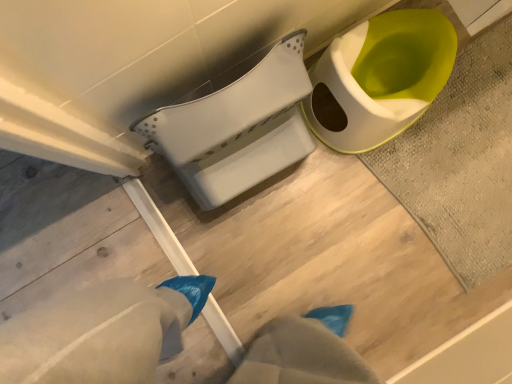
Question: Considering the relative positions of textured gray bath mat at upper right and matte white toilet at upper right, the second toilet in the left-to-right sequence, in the image provided, is textured gray bath mat at upper right behind matte white toilet at upper right, the second toilet in the left-to-right sequence,?

Choices:
 (A) no
 (B) yes

Answer: (B)

Question: Is textured gray bath mat at upper right oriented towards matte white toilet at upper right, the second toilet in the left-to-right sequence?

Choices:
 (A) no
 (B) yes

Answer: (A)

Question: Can you confirm if textured gray bath mat at upper right is shorter than matte white toilet at upper right, which is counted as the 1th toilet, starting from the right?

Choices:
 (A) yes
 (B) no

Answer: (A)

Question: From the image's perspective, would you say textured gray bath mat at upper right is shown under matte white toilet at upper right, which is counted as the 1th toilet, starting from the right?

Choices:
 (A) yes
 (B) no

Answer: (A)

Question: Can you confirm if textured gray bath mat at upper right is positioned to the right of matte white toilet at upper right, the second toilet in the left-to-right sequence?

Choices:
 (A) yes
 (B) no

Answer: (A)

Question: Is matte white toilet at upper right, which is counted as the 1th toilet, starting from the right, at the back of textured gray bath mat at upper right?

Choices:
 (A) no
 (B) yes

Answer: (A)

Question: Considering the relative positions of matte white toilet at upper right, the second toilet in the left-to-right sequence, and white plastic toilet at center, which ranks as the second toilet in right-to-left order, in the image provided, is matte white toilet at upper right, the second toilet in the left-to-right sequence, to the left of white plastic toilet at center, which ranks as the second toilet in right-to-left order, from the viewer's perspective?

Choices:
 (A) yes
 (B) no

Answer: (B)

Question: Is matte white toilet at upper right, the second toilet in the left-to-right sequence, touching white plastic toilet at center, arranged as the 1th toilet when viewed from the left?

Choices:
 (A) yes
 (B) no

Answer: (B)

Question: Does matte white toilet at upper right, the second toilet in the left-to-right sequence, contain white plastic toilet at center, which ranks as the second toilet in right-to-left order?

Choices:
 (A) no
 (B) yes

Answer: (A)

Question: Does matte white toilet at upper right, which is counted as the 1th toilet, starting from the right, come in front of white plastic toilet at center, arranged as the 1th toilet when viewed from the left?

Choices:
 (A) yes
 (B) no

Answer: (B)

Question: Is matte white toilet at upper right, the second toilet in the left-to-right sequence, at the right side of white plastic toilet at center, which ranks as the second toilet in right-to-left order?

Choices:
 (A) yes
 (B) no

Answer: (A)

Question: Is matte white toilet at upper right, the second toilet in the left-to-right sequence, positioned behind white plastic toilet at center, arranged as the 1th toilet when viewed from the left?

Choices:
 (A) yes
 (B) no

Answer: (A)

Question: Is white plastic toilet at center, which ranks as the second toilet in right-to-left order, facing away from textured gray bath mat at upper right?

Choices:
 (A) no
 (B) yes

Answer: (A)